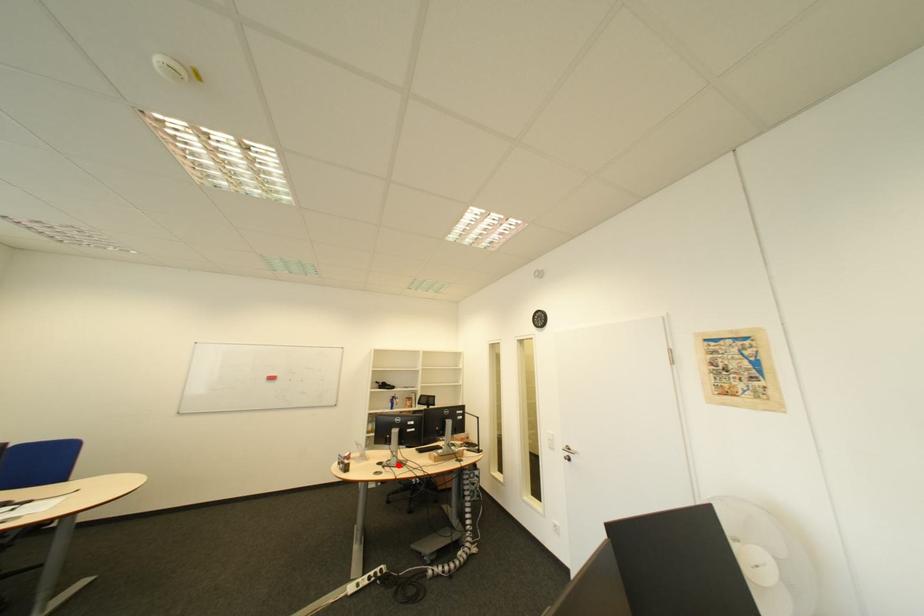
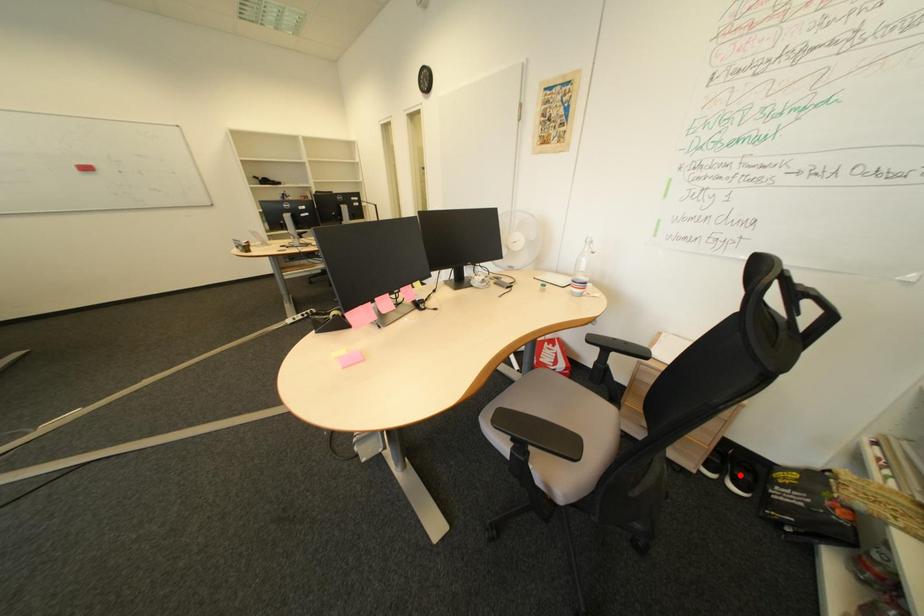
I am providing you with two images of the same scene from different viewpoints. A red point is marked on the first image and another point is marked on the second image. Is the red point in image1 aligned with the point shown in image2?

No